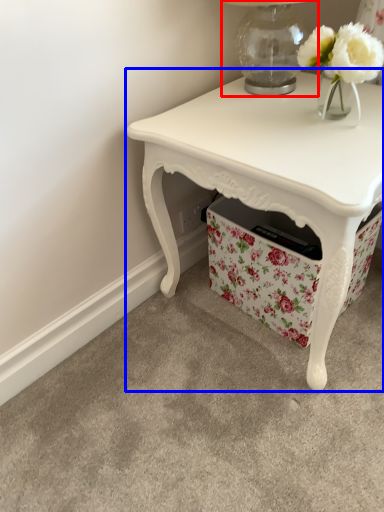
Question: Which point is further to the camera, table lamp (highlighted by a red box) or table (highlighted by a blue box)?

Choices:
 (A) table lamp
 (B) table

Answer: (A)